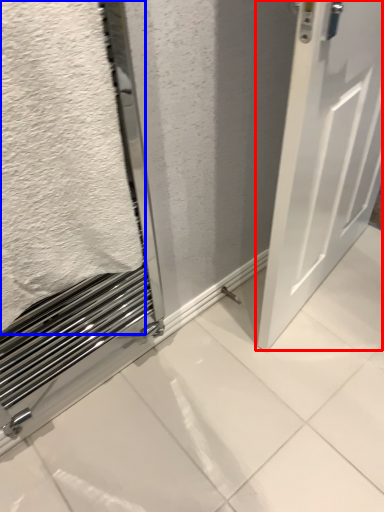
Question: Which point is closer to the camera, door (highlighted by a red box) or bath towel (highlighted by a blue box)?

Choices:
 (A) door
 (B) bath towel

Answer: (B)